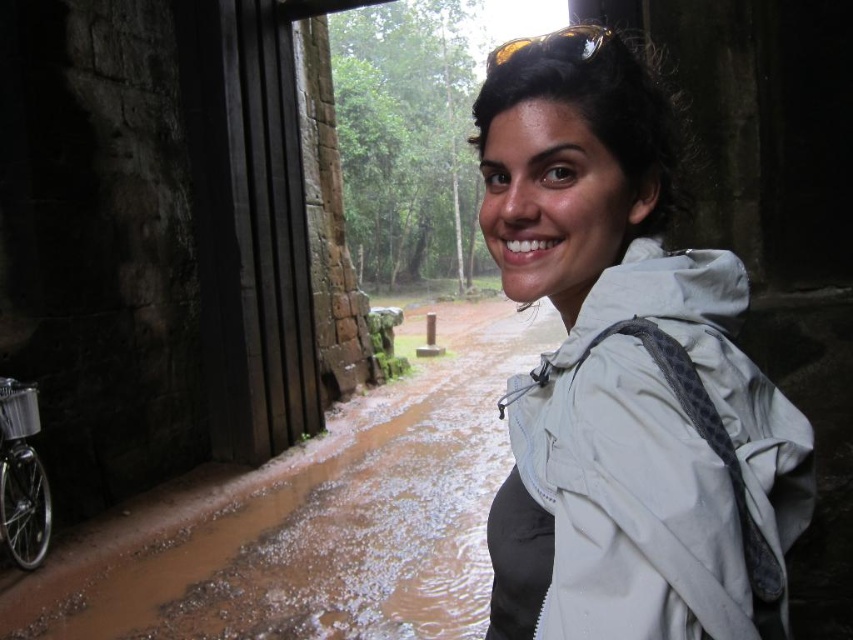
Question: Can you confirm if white matte jacket at center is bigger than brown wet mud at lower left?

Choices:
 (A) no
 (B) yes

Answer: (A)

Question: Can you confirm if white matte jacket at center is positioned above brown wet mud at lower left?

Choices:
 (A) yes
 (B) no

Answer: (A)

Question: Which of the following is the farthest from the observer?

Choices:
 (A) (345, 433)
 (B) (727, 486)

Answer: (A)

Question: Which object appears farthest from the camera in this image?

Choices:
 (A) white matte jacket at center
 (B) brown wet mud at lower left

Answer: (B)

Question: Which point is closer to the camera?

Choices:
 (A) brown wet mud at lower left
 (B) white matte jacket at center

Answer: (B)

Question: Does white matte jacket at center appear under brown wet mud at lower left?

Choices:
 (A) yes
 (B) no

Answer: (B)